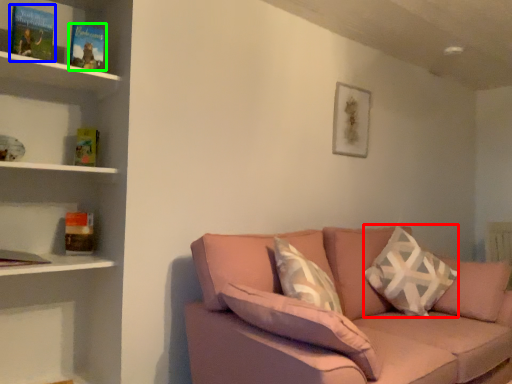
Question: Which is nearer to the throw pillow (highlighted by a red box)? paperback book (highlighted by a blue box) or paperback book (highlighted by a green box).

Choices:
 (A) paperback book
 (B) paperback book

Answer: (B)